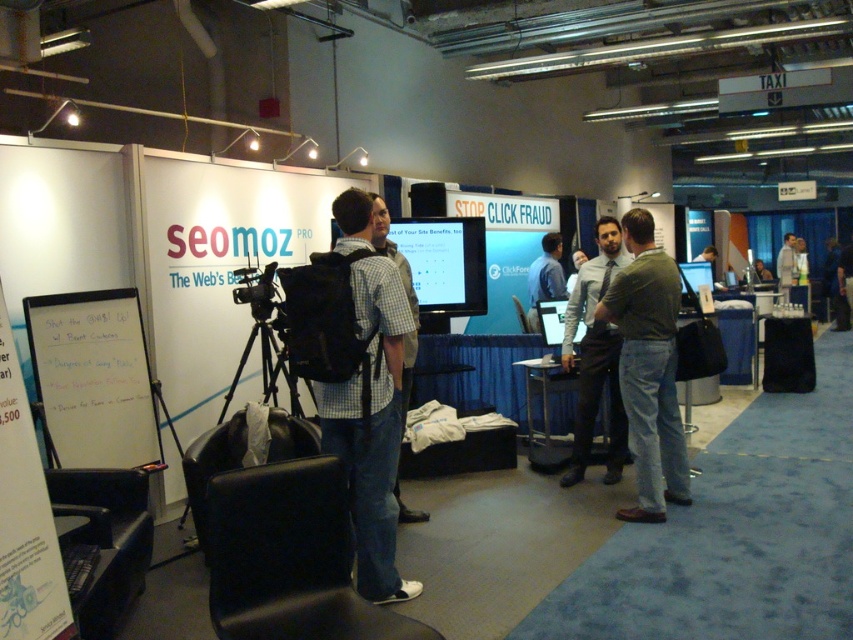
You are at the seomoz PRO booth and notice two people in the foreground. One is wearing a checkered fabric shirt at center and the other a dark blue shirt at center. From your perspective at the booth, which shirt is positioned lower on their respective person?

The checkered fabric shirt at center is below dark blue shirt at center, so the checkered fabric shirt at center is positioned lower.

You are at the seomoz PRO booth and notice two people in front of you. One is wearing a checkered fabric shirt at center and the other a dark blue shirt at center. Which shirt appears taller from your viewpoint?

The checkered fabric shirt at center appears taller than the dark blue shirt at center from your viewpoint.

You are setting up a table for a tech conference and need to place both the silver metallic laptop at center and the light brown leather jacket at center on it. Which item should you place first to ensure they both fit comfortably?

The silver metallic laptop at center is smaller than the light brown leather jacket at center, so you should place the light brown leather jacket at center first to ensure there is enough space for both items.